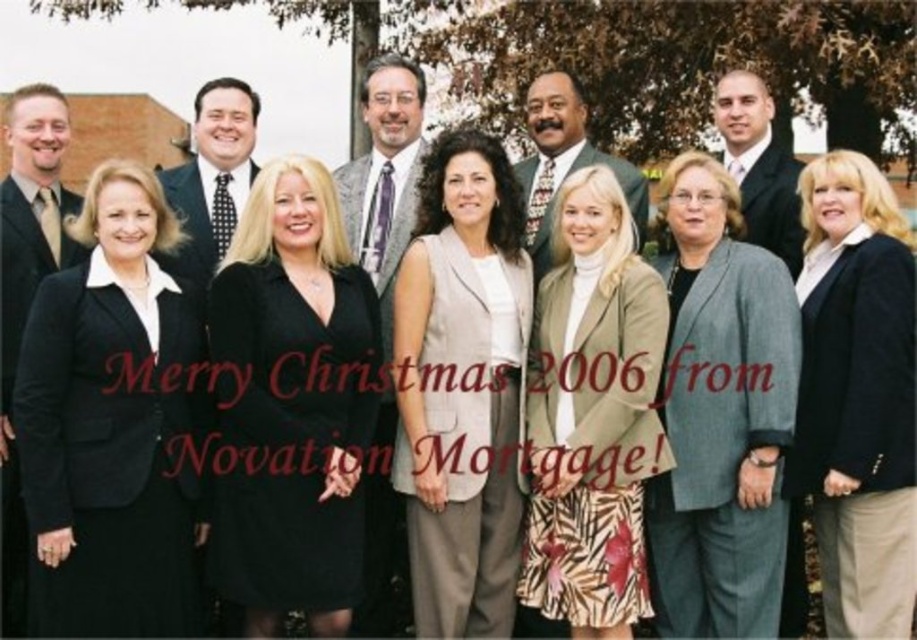
You are a photographer adjusting the camera focus. The beige textured vest at center and the polka dot tie at center are both in the frame. Which one should you focus on to ensure the subject with greater height is sharp?

The beige textured vest at center is much taller than the polka dot tie at center, so you should focus on the beige textured vest at center to ensure the taller subject is sharp.

You are a photographer who needs to adjust the lighting to highlight the black matte dress at center in the image. Since the dress is positioned at coordinates 0.633 on the x and 0.318 on the y, where exactly should you focus the light to ensure it illuminates the dress properly?

The black matte dress at center is located at coordinates 0.633 on the x and 0.318 on the y, so the photographer should focus the light precisely at those coordinates to ensure proper illumination of the dress.